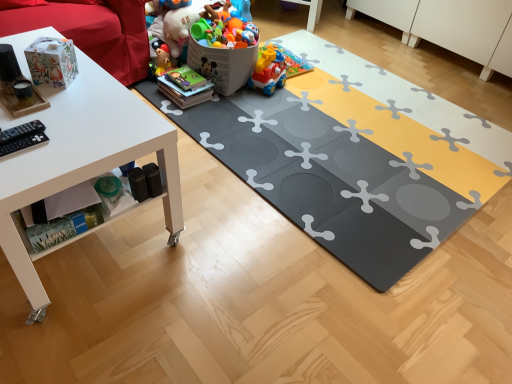
You are a GUI agent. You are given a task and a screenshot of the screen. Output one action in this format:
    pyautogui.click(x=<x>, y=<y>)
    Task: Click on the white matte table at left
    The height and width of the screenshot is (384, 512).
    Given the screenshot: What is the action you would take?
    pyautogui.click(x=82, y=159)

The height and width of the screenshot is (384, 512). Find the location of `plastic multicolored toy train at center, the 4th toy in the front-to-back sequence`. plastic multicolored toy train at center, the 4th toy in the front-to-back sequence is located at coordinates (275, 68).

Are plastic toy at upper center, the second toy positioned from the back, and gray rubber yoga mat at center making contact?

No, plastic toy at upper center, the second toy positioned from the back, is not in contact with gray rubber yoga mat at center.

Is point (183, 24) less distant than point (458, 126)?

No, it is behind (458, 126).

Considering the sizes of plastic toy at upper center, the second toy positioned from the back, and gray rubber yoga mat at center in the image, is plastic toy at upper center, the second toy positioned from the back, wider or thinner than gray rubber yoga mat at center?

Considering their sizes, plastic toy at upper center, the second toy positioned from the back, looks slimmer than gray rubber yoga mat at center.

Which of these two, plastic toy at upper center, the second toy positioned from the back, or gray rubber yoga mat at center, is smaller?

gray rubber yoga mat at center.

Who is smaller, plastic toy at upper center, marked as the third toy in a front-to-back arrangement, or white matte table at left?

plastic toy at upper center, marked as the third toy in a front-to-back arrangement, is smaller.

Looking at this image, which of these two, plastic toy at upper center, the second toy positioned from the back, or white matte table at left, is thinner?

Thinner between the two is plastic toy at upper center, the second toy positioned from the back.

Is point (177, 54) positioned before point (139, 121)?

No, (177, 54) is further to viewer.

Which object is positioned more to the left, plastic toy at upper center, marked as the third toy in a front-to-back arrangement, or white matte table at left?

white matte table at left.

Considering the sizes of objects plastic toy at center, the third toy viewed from the back, and matte paper bag at upper left, which appears as the 1th toy when viewed from the front, in the image provided, who is smaller, plastic toy at center, the third toy viewed from the back, or matte paper bag at upper left, which appears as the 1th toy when viewed from the front,?

With smaller size is matte paper bag at upper left, which appears as the 1th toy when viewed from the front.

Can you tell me how much plastic toy at center, the third toy viewed from the back, and matte paper bag at upper left, which appears as the 1th toy when viewed from the front, differ in facing direction?

25.8 degrees.

Is plastic toy at center, acting as the second toy starting from the front, at the left side of matte paper bag at upper left, placed as the fourth toy when sorted from back to front?

In fact, plastic toy at center, acting as the second toy starting from the front, is to the right of matte paper bag at upper left, placed as the fourth toy when sorted from back to front.

Is plastic toy at center, the third toy viewed from the back, outside of matte paper bag at upper left, placed as the fourth toy when sorted from back to front?

Yes.

Are plastic multicolored toy train at center, the 4th toy in the front-to-back sequence, and plastic toy at upper center, marked as the third toy in a front-to-back arrangement, located far from each other?

Actually, plastic multicolored toy train at center, the 4th toy in the front-to-back sequence, and plastic toy at upper center, marked as the third toy in a front-to-back arrangement, are a little close together.

Who is smaller, plastic multicolored toy train at center, arranged as the 1th toy when viewed from the back, or plastic toy at upper center, the second toy positioned from the back?

plastic multicolored toy train at center, arranged as the 1th toy when viewed from the back.

From the image's perspective, between plastic multicolored toy train at center, arranged as the 1th toy when viewed from the back, and plastic toy at upper center, marked as the third toy in a front-to-back arrangement, which one is located above?

plastic toy at upper center, marked as the third toy in a front-to-back arrangement, from the image's perspective.

From a real-world perspective, is plastic multicolored toy train at center, arranged as the 1th toy when viewed from the back, located beneath plastic toy at upper center, the second toy positioned from the back?

Yes, from a real-world perspective, plastic multicolored toy train at center, arranged as the 1th toy when viewed from the back, is under plastic toy at upper center, the second toy positioned from the back.

Between plastic toy at upper center, the second toy positioned from the back, and matte paper bag at upper left, placed as the fourth toy when sorted from back to front, which one appears on the left side from the viewer's perspective?

matte paper bag at upper left, placed as the fourth toy when sorted from back to front.

Can you confirm if plastic toy at upper center, the second toy positioned from the back, is thinner than matte paper bag at upper left, placed as the fourth toy when sorted from back to front?

Incorrect, the width of plastic toy at upper center, the second toy positioned from the back, is not less than that of matte paper bag at upper left, placed as the fourth toy when sorted from back to front.

Is plastic toy at upper center, the second toy positioned from the back, oriented towards matte paper bag at upper left, which appears as the 1th toy when viewed from the front?

No, plastic toy at upper center, the second toy positioned from the back, is not aimed at matte paper bag at upper left, which appears as the 1th toy when viewed from the front.

From a real-world perspective, is plastic toy at upper center, the second toy positioned from the back, on matte paper bag at upper left, placed as the fourth toy when sorted from back to front?

No.

Is white matte table at left in contact with plastic toy at center, the third toy viewed from the back?

There is a gap between white matte table at left and plastic toy at center, the third toy viewed from the back.

In the scene shown: Considering the relative positions of white matte table at left and plastic toy at center, the third toy viewed from the back, in the image provided, is white matte table at left to the left or to the right of plastic toy at center, the third toy viewed from the back,?

From the image, it's evident that white matte table at left is to the left of plastic toy at center, the third toy viewed from the back.

How many degrees apart are the facing directions of white matte table at left and plastic toy at center, acting as the second toy starting from the front?

The facing directions of white matte table at left and plastic toy at center, acting as the second toy starting from the front, are 17.2 degrees apart.

Could you measure the distance between white matte table at left and plastic toy at center, acting as the second toy starting from the front?

3.56 feet.

From the image's perspective, would you say gray rubber yoga mat at center is shown under white matte table at left?

No.

Looking at this image, is gray rubber yoga mat at center wider than white matte table at left?

Yes.

From the picture: How many degrees apart are the facing directions of gray rubber yoga mat at center and white matte table at left?

The angular difference between gray rubber yoga mat at center and white matte table at left is 0.96 degrees.

Which object is positioned more to the right, gray rubber yoga mat at center or white matte table at left?

From the viewer's perspective, gray rubber yoga mat at center appears more on the right side.

Locate an element on the screen. Image resolution: width=512 pixels, height=384 pixels. yoga mat below the plastic toy at upper center, the second toy positioned from the back (from the image's perspective) is located at coordinates (355, 159).

The height and width of the screenshot is (384, 512). I want to click on the 3rd toy behind the white matte table at left, so click(x=174, y=23).

Based on their spatial positions, is plastic toy at upper center, the second toy positioned from the back, or plastic toy at center, the third toy viewed from the back, further from gray rubber yoga mat at center?

plastic toy at upper center, the second toy positioned from the back, is further to gray rubber yoga mat at center.

From the image, which object appears to be nearer to gray rubber yoga mat at center, white matte table at left or plastic multicolored toy train at center, the 4th toy in the front-to-back sequence?

The object closer to gray rubber yoga mat at center is plastic multicolored toy train at center, the 4th toy in the front-to-back sequence.

Considering their positions, is gray rubber yoga mat at center positioned further to plastic toy at center, the third toy viewed from the back, than white matte table at left?

white matte table at left is further to plastic toy at center, the third toy viewed from the back.

Looking at the image, which one is located further to matte paper bag at upper left, placed as the fourth toy when sorted from back to front, plastic toy at upper center, marked as the third toy in a front-to-back arrangement, or plastic toy at center, the third toy viewed from the back?

plastic toy at upper center, marked as the third toy in a front-to-back arrangement, is positioned further to the anchor matte paper bag at upper left, placed as the fourth toy when sorted from back to front.

Looking at this image, looking at the image, which one is located further to gray rubber yoga mat at center, matte paper bag at upper left, placed as the fourth toy when sorted from back to front, or plastic multicolored toy train at center, the 4th toy in the front-to-back sequence?

matte paper bag at upper left, placed as the fourth toy when sorted from back to front, is positioned further to the anchor gray rubber yoga mat at center.

Which object lies further to the anchor point plastic toy at center, acting as the second toy starting from the front, white matte table at left or gray rubber yoga mat at center?

Based on the image, white matte table at left appears to be further to plastic toy at center, acting as the second toy starting from the front.

Based on their spatial positions, is plastic toy at upper center, marked as the third toy in a front-to-back arrangement, or plastic multicolored toy train at center, the 4th toy in the front-to-back sequence, further from white matte table at left?

plastic multicolored toy train at center, the 4th toy in the front-to-back sequence, lies further to white matte table at left than the other object.

From the picture: Based on their spatial positions, is plastic multicolored toy train at center, arranged as the 1th toy when viewed from the back, or white matte table at left closer to matte paper bag at upper left, which appears as the 1th toy when viewed from the front?

white matte table at left is closer to matte paper bag at upper left, which appears as the 1th toy when viewed from the front.

Find the location of a particular element. The image size is (512, 384). yoga mat between white matte table at left and plastic toy at upper center, the second toy positioned from the back, along the z-axis is located at coordinates (355, 159).

This screenshot has height=384, width=512. Find the location of `toy between plastic toy at upper center, marked as the third toy in a front-to-back arrangement, and plastic multicolored toy train at center, arranged as the 1th toy when viewed from the back, in the vertical direction`. toy between plastic toy at upper center, marked as the third toy in a front-to-back arrangement, and plastic multicolored toy train at center, arranged as the 1th toy when viewed from the back, in the vertical direction is located at coordinates (206, 39).

Find the location of a particular element. yoga mat between white matte table at left and plastic multicolored toy train at center, the 4th toy in the front-to-back sequence, along the z-axis is located at coordinates (355, 159).

Where is `toy between white matte table at left and plastic toy at center, acting as the second toy starting from the front, along the z-axis`? This screenshot has width=512, height=384. toy between white matte table at left and plastic toy at center, acting as the second toy starting from the front, along the z-axis is located at coordinates (52, 62).